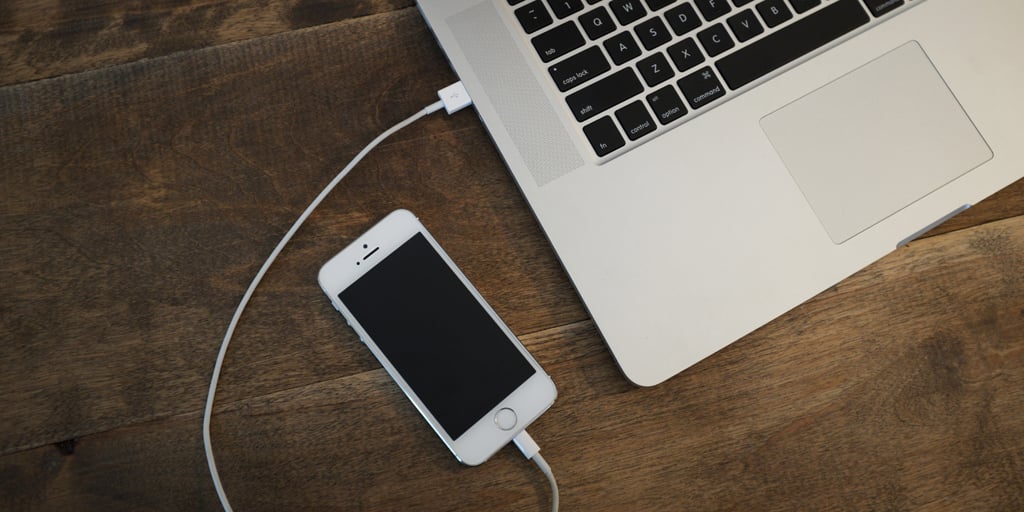
This screenshot has height=512, width=1024. What are the coordinates of `charger cable` in the screenshot? It's located at (304, 201), (200, 451), (557, 490).